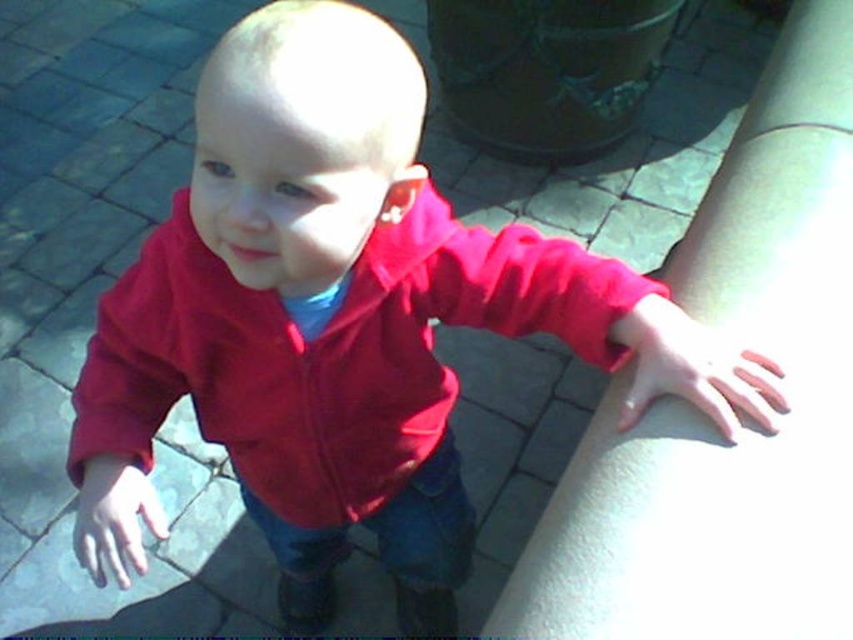
Who is positioned more to the left, matte red sleeve at lower left or matte red hand at lower left?

matte red sleeve at lower left is more to the left.

Does matte red sleeve at lower left appear on the right side of matte red hand at lower left?

No, matte red sleeve at lower left is not to the right of matte red hand at lower left.

At what (x,y) coordinates should I click in order to perform the action: click on matte red sleeve at lower left. Please return your answer as a coordinate pair (x, y). The width and height of the screenshot is (853, 640). Looking at the image, I should click on (115, 464).

In the scene shown: Between smooth skin hand at lower right and matte red hand at lower left, which one has more height?

matte red hand at lower left is taller.

Is point (677, 381) positioned in front of point (148, 504)?

Yes, point (677, 381) is closer to viewer.

Identify the location of smooth skin hand at lower right. This screenshot has width=853, height=640. (695, 369).

From the picture: Is matte red jacket at center taller than matte red hand at lower left?

Yes.

Does matte red jacket at center appear on the left side of matte red hand at lower left?

In fact, matte red jacket at center is to the right of matte red hand at lower left.

Locate an element on the screen. This screenshot has height=640, width=853. matte red jacket at center is located at coordinates (328, 353).

What are the coordinates of `matte red jacket at center` in the screenshot? It's located at (328, 353).